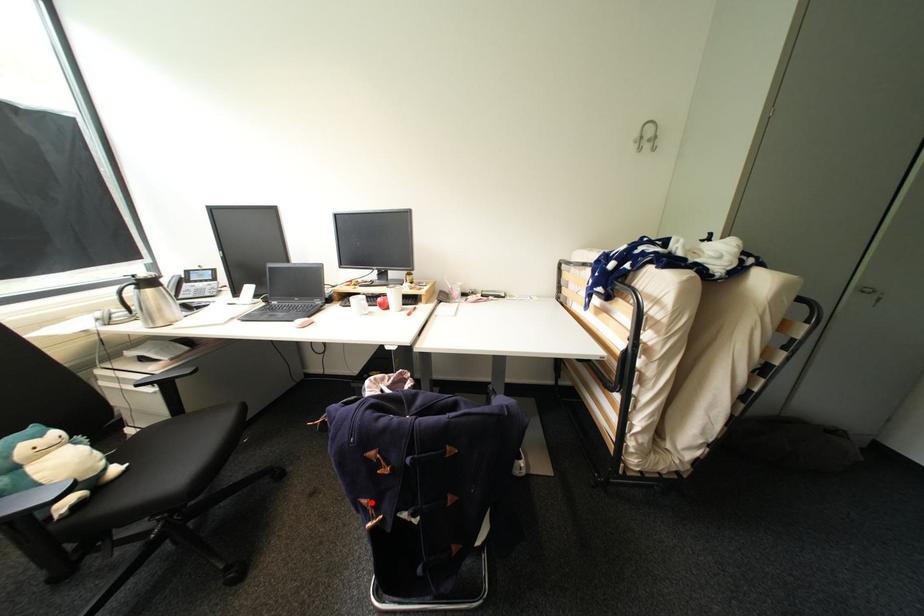
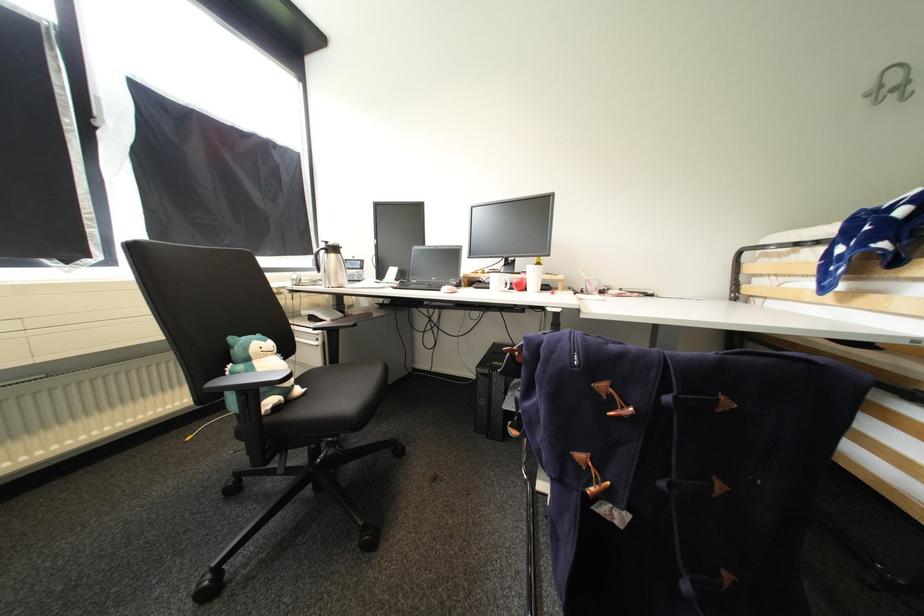
Question: I am providing you with two images of the same scene from different viewpoints. In image1, a red point is highlighted. Considering the same 3D point in image2, which of the following is correct?

Choices:
 (A) It is closer
 (B) It is farther

Answer: (A)